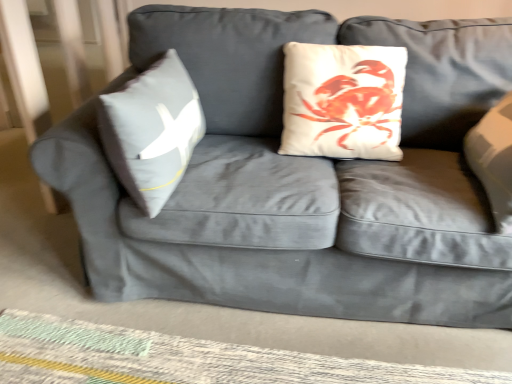
What are the coordinates of `free point above woven fabric mat at lower center (from a real-world perspective)` in the screenshot? It's located at (185, 353).